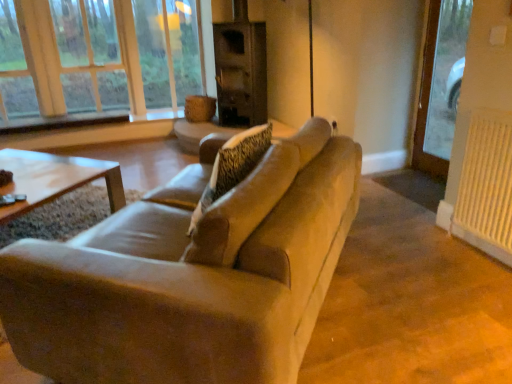
Question: From the image's perspective, relative to dark brown wood fireplace at center, is beige fabric couch at center above or below?

Choices:
 (A) above
 (B) below

Answer: (B)

Question: From a real-world perspective, is beige fabric couch at center positioned above or below dark brown wood fireplace at center?

Choices:
 (A) below
 (B) above

Answer: (A)

Question: Based on their relative distances, which object is farther from the wooden frame at upper left?

Choices:
 (A) beige fabric couch at center
 (B) white textured radiator at right
 (C) dark brown wood fireplace at center

Answer: (B)

Question: Estimate the real-world distances between objects in this image. Which object is farther from the dark brown wood fireplace at center?

Choices:
 (A) wooden frame at upper left
 (B) white textured radiator at right
 (C) beige fabric couch at center

Answer: (C)